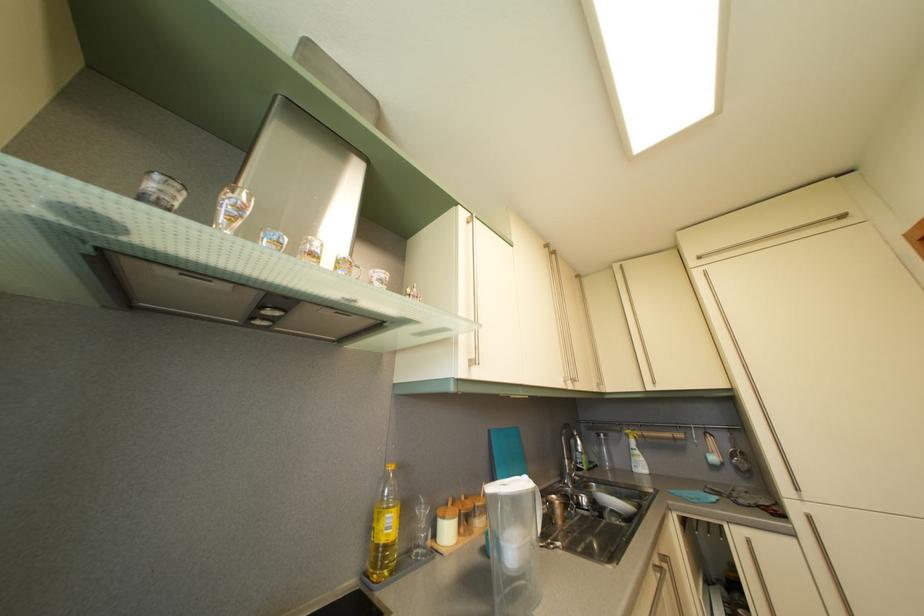
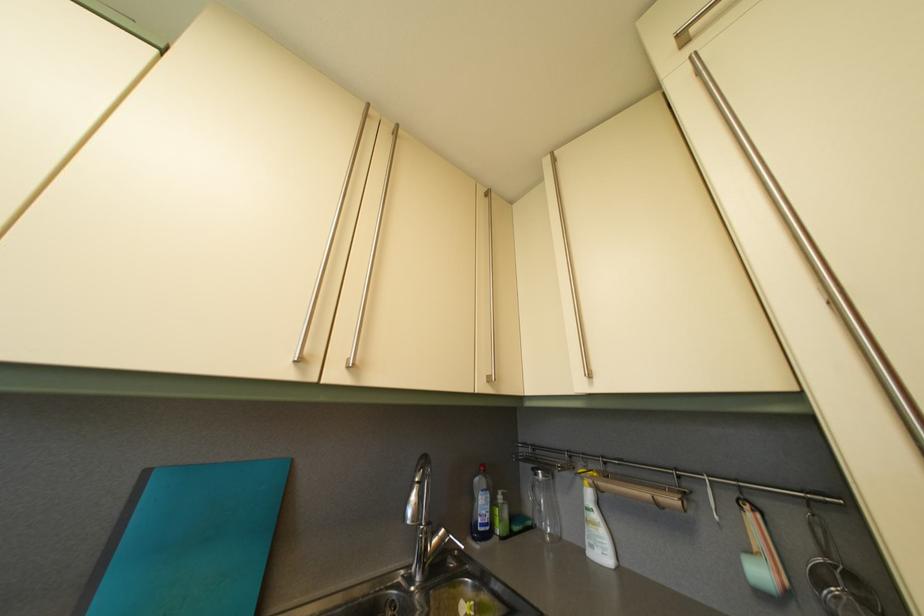
Locate, in the second image, the point that corresponds to (624,274) in the first image.

(554, 169)